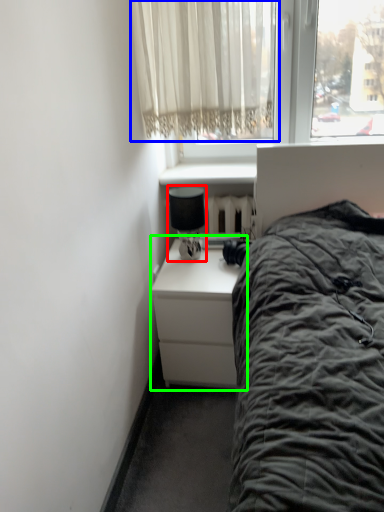
Question: Which is nearer to the lamp (highlighted by a red box)? curtain (highlighted by a blue box) or nightstand (highlighted by a green box).

Choices:
 (A) curtain
 (B) nightstand

Answer: (B)